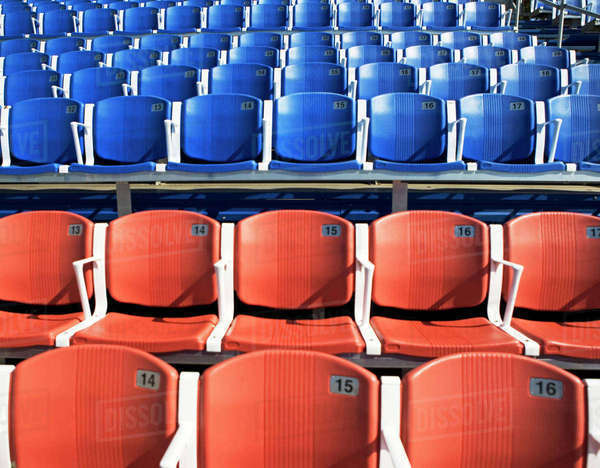
Where is `blue seats in the third row`? This screenshot has width=600, height=468. blue seats in the third row is located at coordinates (34, 58), (84, 59), (126, 55), (189, 54), (257, 53), (311, 51), (375, 49), (431, 49), (488, 53), (546, 53).